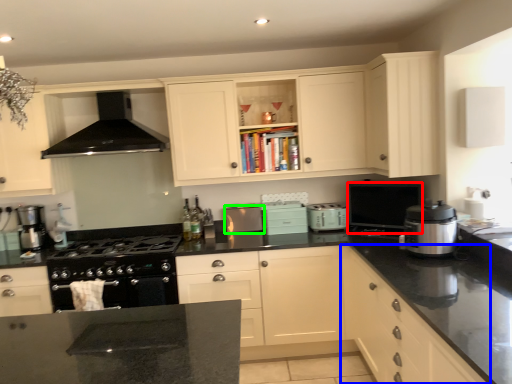
Question: Based on their relative distances, which object is nearer to appliance (highlighted by a red box)? Choose from cabinetry (highlighted by a blue box) and kitchen appliance (highlighted by a green box).

Choices:
 (A) cabinetry
 (B) kitchen appliance

Answer: (A)